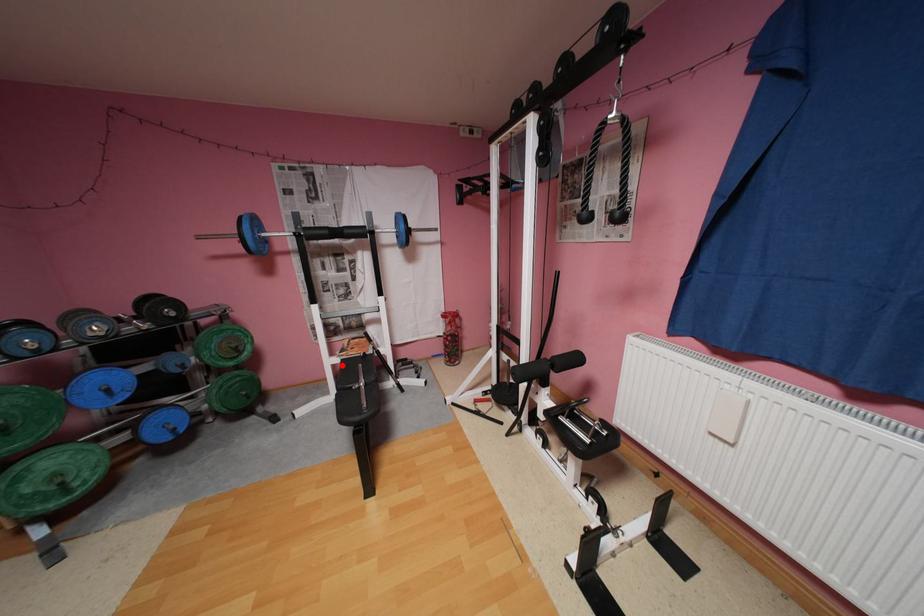
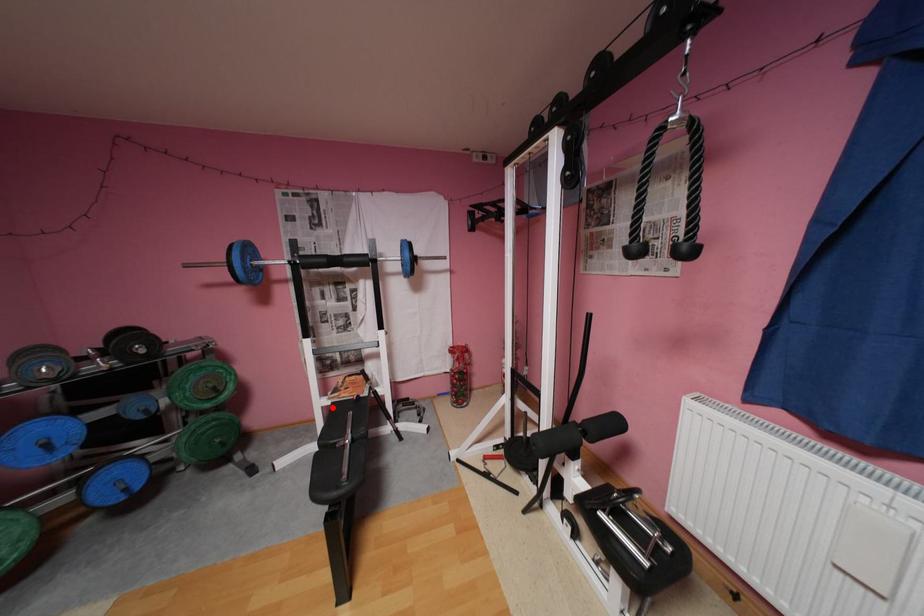
I am providing you with two images of the same scene from different viewpoints. A red point is marked on the first image and another point is marked on the second image. Are the points marked in image1 and image2 representing the same 3D position?

Yes